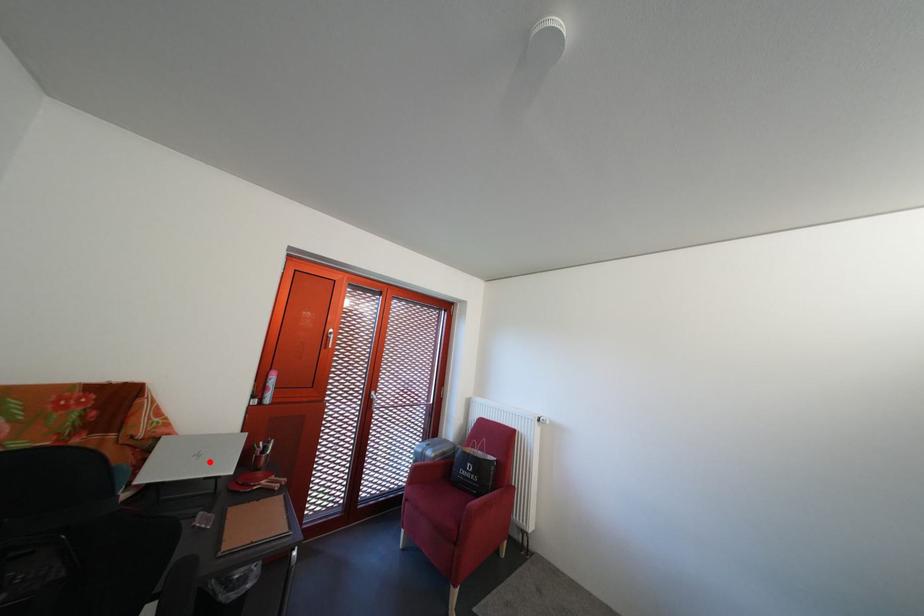
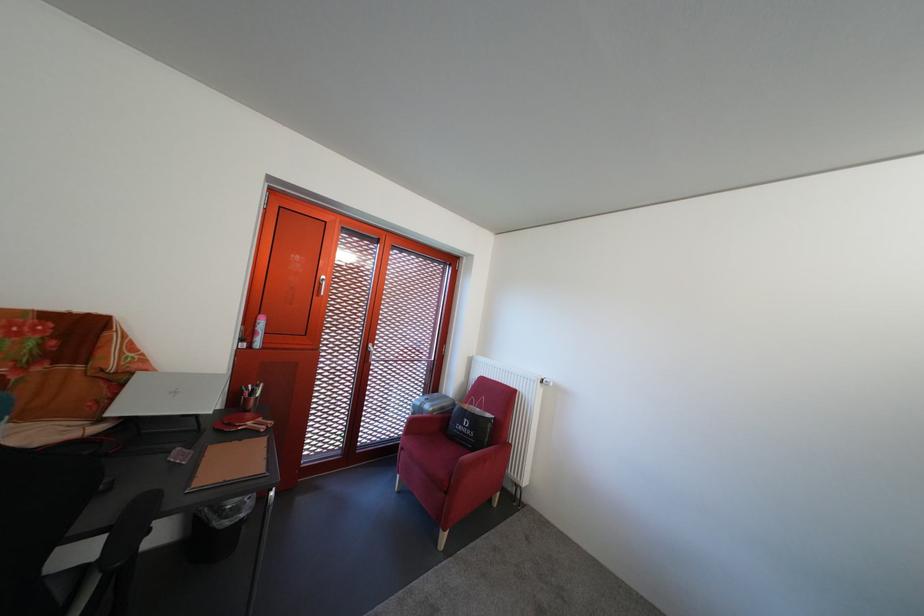
Find the pixel in the second image that matches the highlighted location in the first image.

(187, 399)